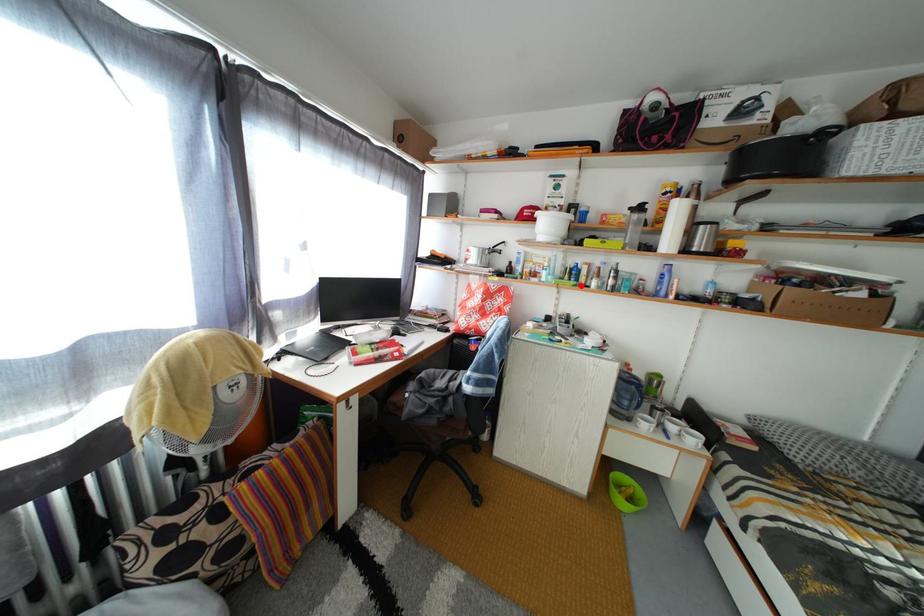
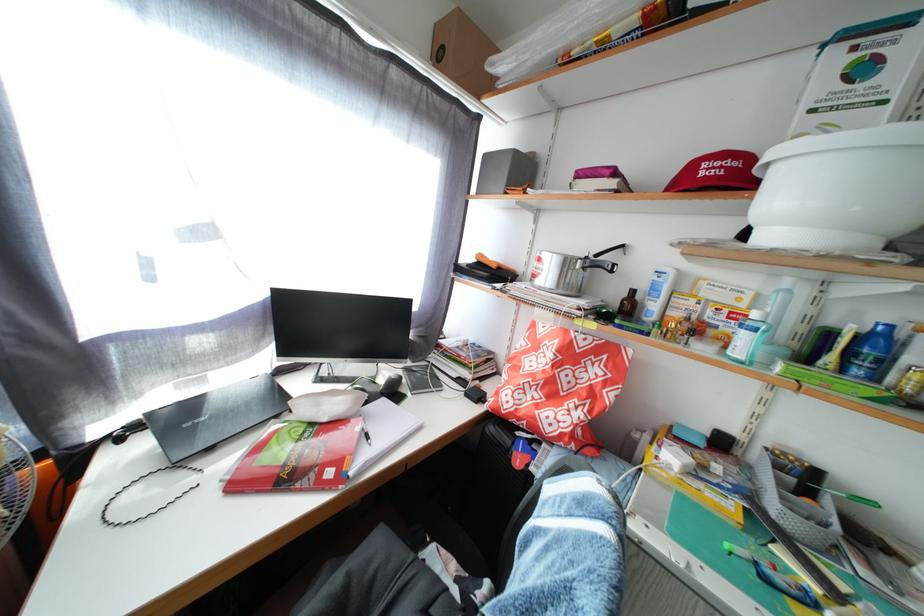
Locate, in the second image, the point that corresponds to the highlighted location in the first image.

(866, 378)